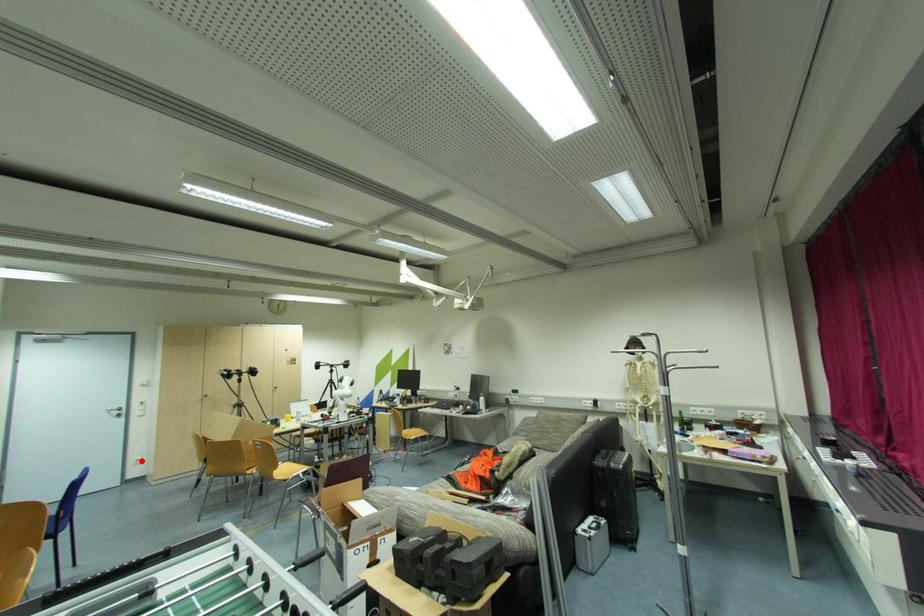
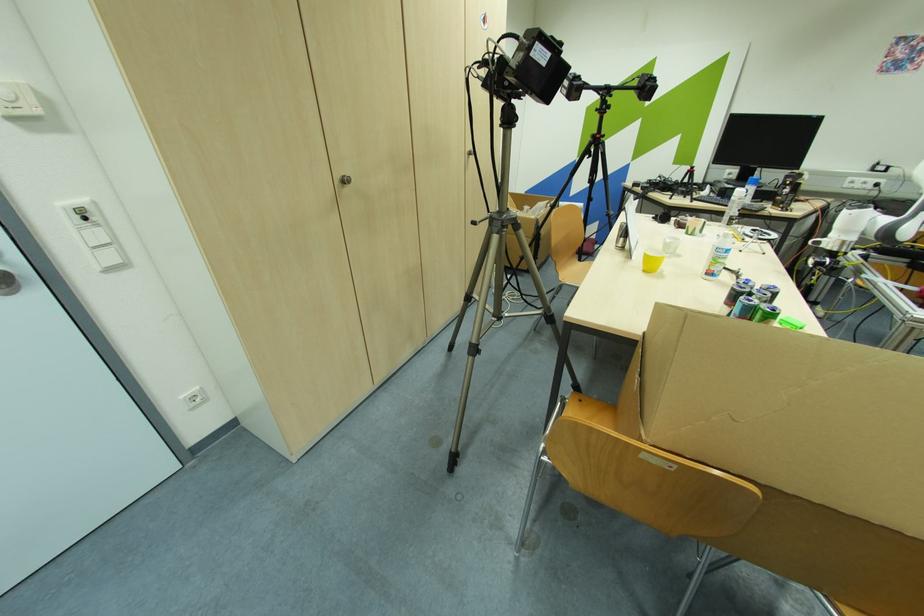
Question: I am providing you with two images of the same scene from different viewpoints. Given a red point in image1, look at the same physical point in image2. Is it:

Choices:
 (A) Closer to the viewpoint
 (B) Farther from the viewpoint

Answer: (B)